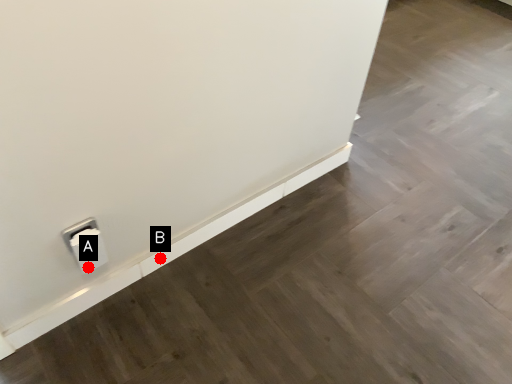
Question: Two points are circled on the image, labeled by A and B beside each circle. Which point appears closest to the camera in this image?

Choices:
 (A) A is closer
 (B) B is closer

Answer: (A)